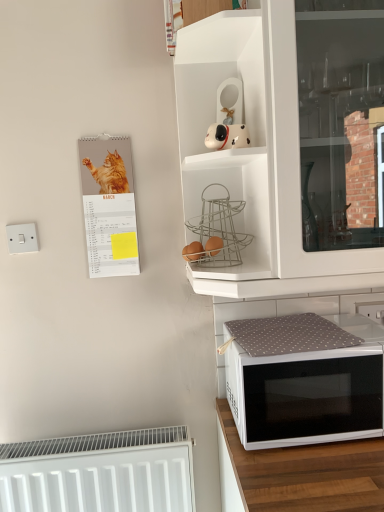
Question: From the image's perspective, is white matte radiator at lower left located above white plastic electric outlet at upper right?

Choices:
 (A) no
 (B) yes

Answer: (A)

Question: Is white matte radiator at lower left shorter than white plastic electric outlet at upper right?

Choices:
 (A) no
 (B) yes

Answer: (A)

Question: Could you tell me if white matte radiator at lower left is facing white plastic electric outlet at upper right?

Choices:
 (A) no
 (B) yes

Answer: (A)

Question: Is white matte radiator at lower left in contact with white plastic electric outlet at upper right?

Choices:
 (A) no
 (B) yes

Answer: (A)

Question: Is white matte radiator at lower left at the right side of white plastic electric outlet at upper right?

Choices:
 (A) yes
 (B) no

Answer: (B)

Question: Can you confirm if white matte radiator at lower left is taller than white plastic electric outlet at upper right?

Choices:
 (A) no
 (B) yes

Answer: (B)

Question: Can you confirm if white fabric-covered microwave at lower right is taller than matte paper calendar at left?

Choices:
 (A) no
 (B) yes

Answer: (A)

Question: Considering the relative sizes of white fabric-covered microwave at lower right and matte paper calendar at left in the image provided, is white fabric-covered microwave at lower right thinner than matte paper calendar at left?

Choices:
 (A) no
 (B) yes

Answer: (A)

Question: From a real-world perspective, is white fabric-covered microwave at lower right beneath matte paper calendar at left?

Choices:
 (A) yes
 (B) no

Answer: (A)

Question: Is the position of white fabric-covered microwave at lower right less distant than that of matte paper calendar at left?

Choices:
 (A) no
 (B) yes

Answer: (B)

Question: Considering the relative sizes of white fabric-covered microwave at lower right and matte paper calendar at left in the image provided, is white fabric-covered microwave at lower right wider than matte paper calendar at left?

Choices:
 (A) no
 (B) yes

Answer: (B)

Question: Can you confirm if white fabric-covered microwave at lower right is positioned to the left of matte paper calendar at left?

Choices:
 (A) yes
 (B) no

Answer: (B)

Question: Can you confirm if matte paper calendar at left is bigger than white matte dog figurine at upper center?

Choices:
 (A) no
 (B) yes

Answer: (B)